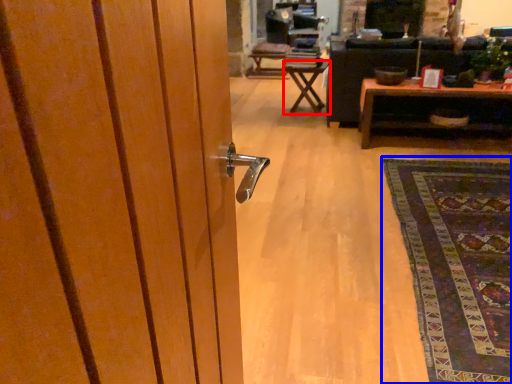
Question: Among these objects, which one is farthest to the camera, table (highlighted by a red box) or mat (highlighted by a blue box)?

Choices:
 (A) table
 (B) mat

Answer: (A)